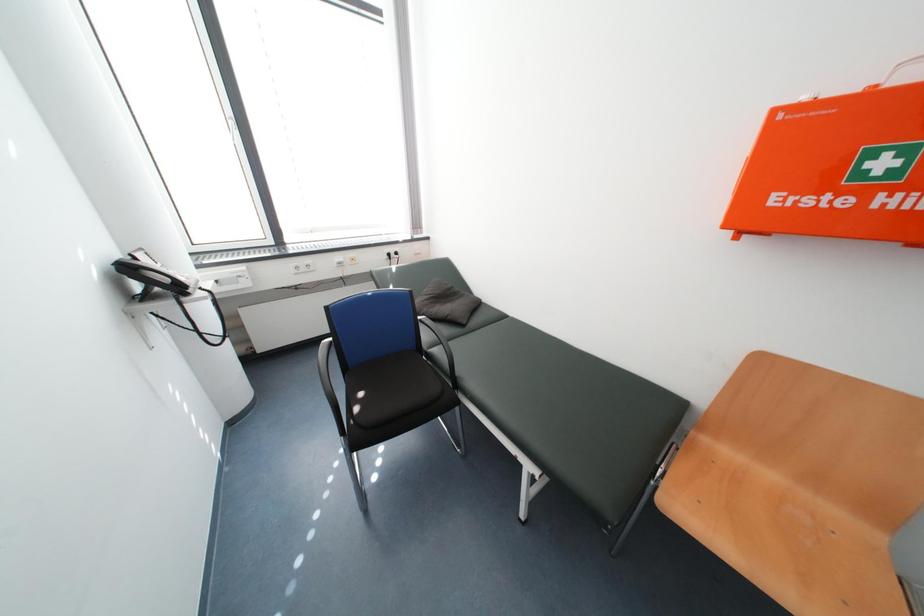
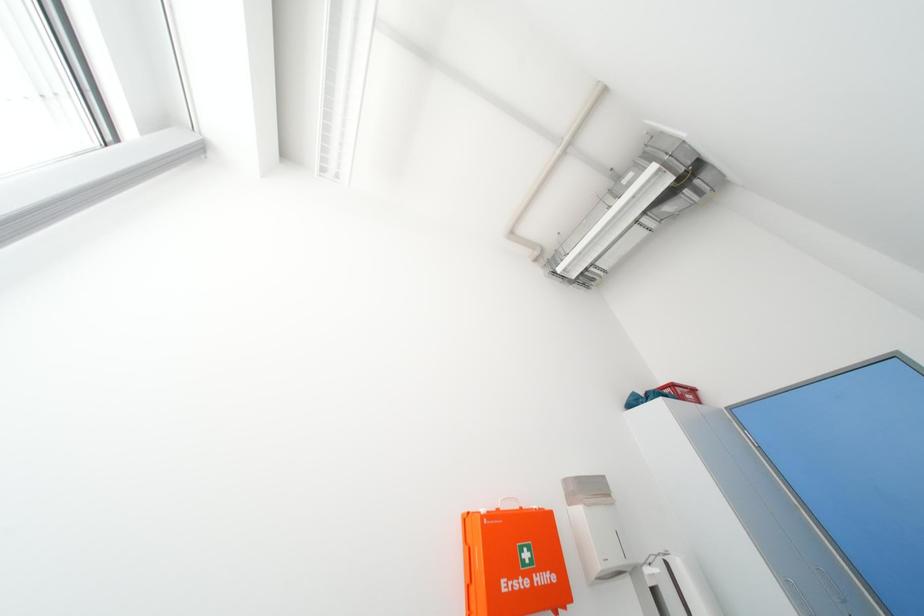
How did the camera likely rotate?

The camera rotated toward right-up.